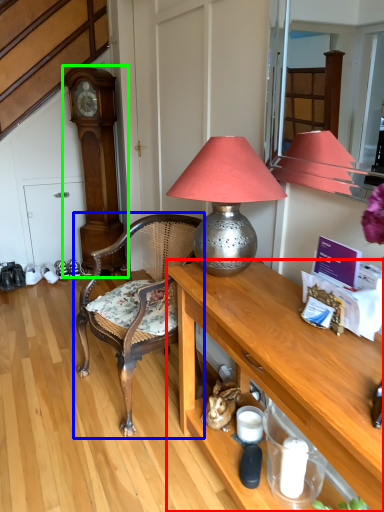
Question: Which object is positioned farthest from desk (highlighted by a red box)? Select from chair (highlighted by a blue box) and clock (highlighted by a green box).

Choices:
 (A) chair
 (B) clock

Answer: (B)